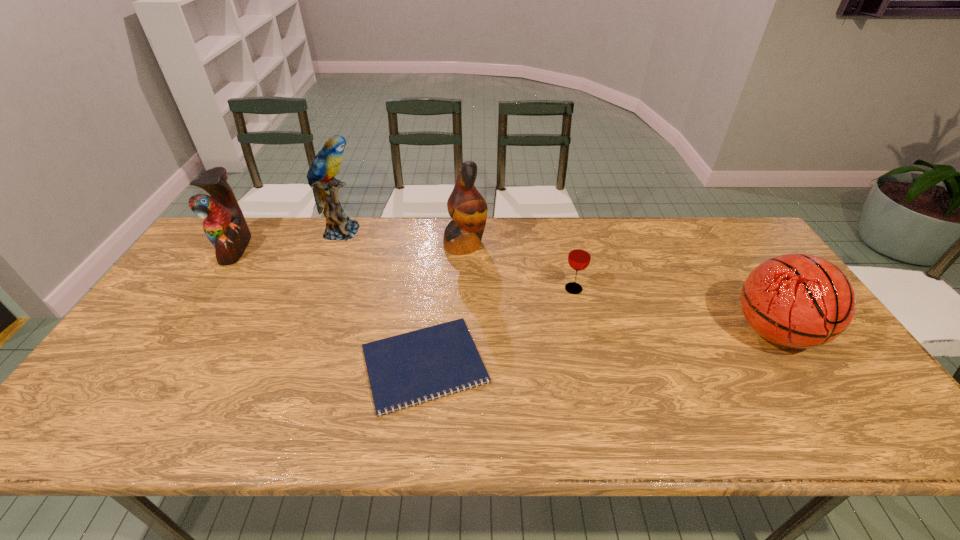
The height and width of the screenshot is (540, 960). I want to click on vacant area at the right edge, so click(x=828, y=348).

Identify the location of vacant position at the far left corner of the desktop. (269, 218).

This screenshot has height=540, width=960. In the image, there is a desktop. Identify the location of vacant space at the far right corner. (722, 235).

Where is `free space between the shortest parrot and the rightmost parrot`? free space between the shortest parrot and the rightmost parrot is located at coordinates (350, 246).

I want to click on free space between the glass and the basketball, so pyautogui.click(x=674, y=310).

The width and height of the screenshot is (960, 540). Find the location of `free space that is in between the rightmost parrot and the shortest parrot`. free space that is in between the rightmost parrot and the shortest parrot is located at coordinates (350, 246).

This screenshot has height=540, width=960. Find the location of `free area in between the shortest object and the rightmost parrot`. free area in between the shortest object and the rightmost parrot is located at coordinates (444, 304).

In order to click on vacant space that's between the notepad and the rightmost parrot in this screenshot , I will do click(x=444, y=304).

Find the location of a particular element. This screenshot has height=540, width=960. vacant space that's between the fifth object from left to right and the shortest parrot is located at coordinates point(404,269).

Where is `vacant space in between the second parrot from left to right and the rightmost parrot`? The height and width of the screenshot is (540, 960). vacant space in between the second parrot from left to right and the rightmost parrot is located at coordinates (403, 238).